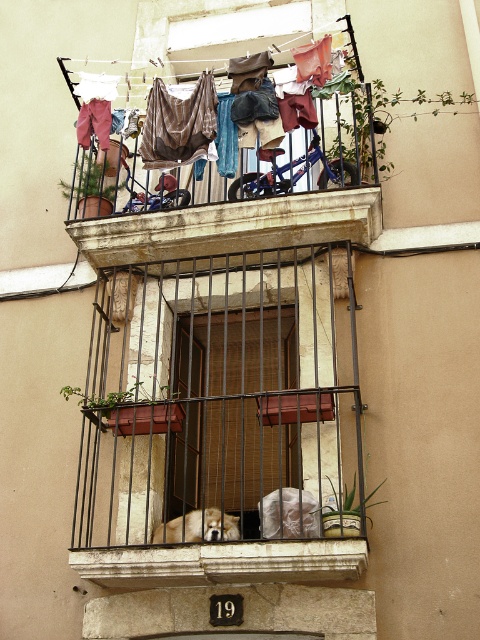
Question: Estimate the real-world distances between objects in this image. Which object is closer to the rustic stone balcony at center?

Choices:
 (A) fuzzy beige dog at lower center
 (B) brown fabric pants at upper center
 (C) white stone window sill at lower center

Answer: (A)

Question: Is rustic stone balcony at center bigger than wooden blinds at center?

Choices:
 (A) no
 (B) yes

Answer: (B)

Question: Estimate the real-world distances between objects in this image. Which object is closer to the wooden blinds at center?

Choices:
 (A) fuzzy beige dog at lower center
 (B) rustic stone balcony at center

Answer: (B)

Question: Which of the following is the farthest from the observer?

Choices:
 (A) rustic wood balcony at upper center
 (B) rustic stone balcony at center

Answer: (A)

Question: Does wooden blinds at center appear on the left side of white stone window sill at lower center?

Choices:
 (A) yes
 (B) no

Answer: (B)

Question: Can you confirm if rustic stone balcony at center is bigger than velvet-like brown cloth at upper center?

Choices:
 (A) yes
 (B) no

Answer: (A)